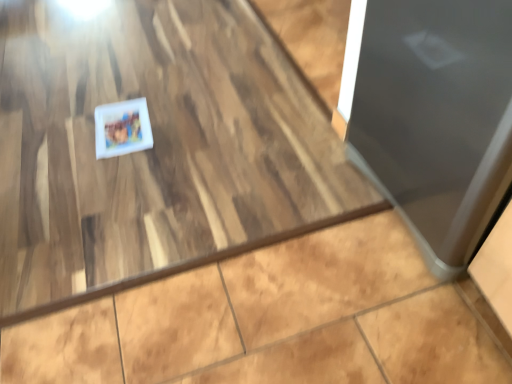
The height and width of the screenshot is (384, 512). I want to click on free spot below white matte postcard at center (from a real-world perspective), so (121, 129).